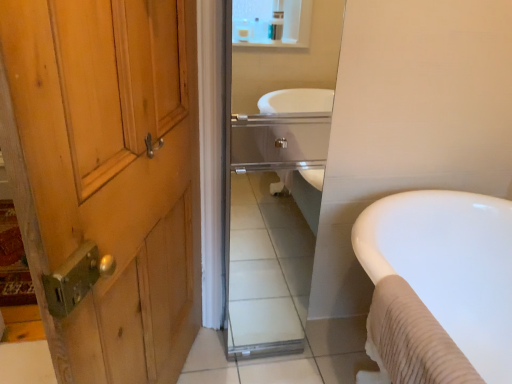
What do you see at coordinates (284, 105) in the screenshot?
I see `glossy glass mirror at center` at bounding box center [284, 105].

Where is `glossy glass mirror at center`? This screenshot has width=512, height=384. glossy glass mirror at center is located at coordinates click(x=284, y=105).

The image size is (512, 384). What do you see at coordinates (438, 286) in the screenshot?
I see `white glossy bathtub at right` at bounding box center [438, 286].

Where is `white glossy bathtub at right`? The height and width of the screenshot is (384, 512). white glossy bathtub at right is located at coordinates (438, 286).

The image size is (512, 384). In order to click on glossy glass mirror at center in this screenshot , I will do `click(284, 105)`.

Does glossy glass mirror at center appear on the right side of white glossy bathtub at right?

In fact, glossy glass mirror at center is to the left of white glossy bathtub at right.

Is glossy glass mirror at center in front of white glossy bathtub at right?

No, glossy glass mirror at center is further to the viewer.

Does point (281, 76) come closer to viewer compared to point (507, 338)?

No, (281, 76) is behind (507, 338).

From the image's perspective, between glossy glass mirror at center and white glossy bathtub at right, which one is located above?

From the image's view, glossy glass mirror at center is above.

From a real-world perspective, between glossy glass mirror at center and white glossy bathtub at right, who is vertically higher?

In real-world perspective, glossy glass mirror at center is above.

In the scene shown: Considering the sizes of objects glossy glass mirror at center and white glossy bathtub at right in the image provided, who is thinner, glossy glass mirror at center or white glossy bathtub at right?

With smaller width is glossy glass mirror at center.

Does glossy glass mirror at center have a greater height compared to white glossy bathtub at right?

Yes, glossy glass mirror at center is taller than white glossy bathtub at right.

Which of these two, glossy glass mirror at center or white glossy bathtub at right, is bigger?

Bigger between the two is white glossy bathtub at right.

Is glossy glass mirror at center spatially inside white glossy bathtub at right, or outside of it?

glossy glass mirror at center exists outside the volume of white glossy bathtub at right.

Consider the image. Is glossy glass mirror at center not close to white glossy bathtub at right?

That's right, there is a large distance between glossy glass mirror at center and white glossy bathtub at right.

Is glossy glass mirror at center oriented away from white glossy bathtub at right?

glossy glass mirror at center is not turned away from white glossy bathtub at right.

How far apart are glossy glass mirror at center and white glossy bathtub at right?

glossy glass mirror at center is 4.57 feet away from white glossy bathtub at right.

Where is `bathtub on the right of glossy glass mirror at center`? Image resolution: width=512 pixels, height=384 pixels. bathtub on the right of glossy glass mirror at center is located at coordinates (438, 286).

Can you confirm if white glossy bathtub at right is positioned to the left of glossy glass mirror at center?

No, white glossy bathtub at right is not to the left of glossy glass mirror at center.

Does white glossy bathtub at right come behind glossy glass mirror at center?

No.

Is point (411, 269) positioned behind point (234, 81)?

That is False.

From the image's perspective, is white glossy bathtub at right above or below glossy glass mirror at center?

white glossy bathtub at right is below glossy glass mirror at center.

From a real-world perspective, is white glossy bathtub at right physically above glossy glass mirror at center?

No, from a real-world perspective, white glossy bathtub at right is not above glossy glass mirror at center.

Between white glossy bathtub at right and glossy glass mirror at center, which one has smaller width?

glossy glass mirror at center.

Considering the relative sizes of white glossy bathtub at right and glossy glass mirror at center in the image provided, is white glossy bathtub at right shorter than glossy glass mirror at center?

Indeed, white glossy bathtub at right has a lesser height compared to glossy glass mirror at center.

Considering the sizes of white glossy bathtub at right and glossy glass mirror at center in the image, is white glossy bathtub at right bigger or smaller than glossy glass mirror at center?

In the image, white glossy bathtub at right appears to be larger than glossy glass mirror at center.

Would you say glossy glass mirror at center is part of white glossy bathtub at right's contents?

No.

Are white glossy bathtub at right and glossy glass mirror at center located far from each other?

Absolutely, white glossy bathtub at right is distant from glossy glass mirror at center.

Is white glossy bathtub at right oriented away from glossy glass mirror at center?

No, white glossy bathtub at right is not facing the opposite direction of glossy glass mirror at center.

How many degrees apart are the facing directions of white glossy bathtub at right and glossy glass mirror at center?

88 degrees.

Locate an element on the screen. This screenshot has width=512, height=384. bathtub that is under the glossy glass mirror at center (from a real-world perspective) is located at coordinates (438, 286).

At what (x,y) coordinates should I click in order to perform the action: click on bathtub located underneath the glossy glass mirror at center (from a real-world perspective). Please return your answer as a coordinate pair (x, y). Looking at the image, I should click on (438, 286).

Locate an element on the screen. This screenshot has width=512, height=384. mirror on the left of the white glossy bathtub at right is located at coordinates (284, 105).